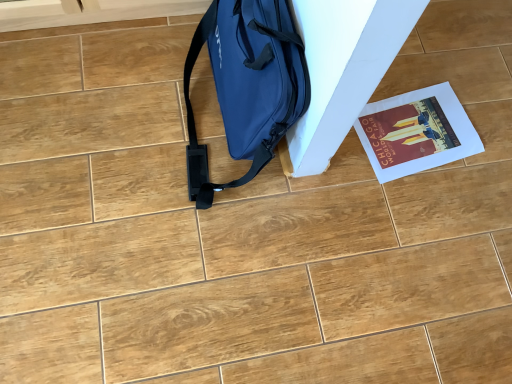
At what (x,y) coordinates should I click in order to perform the action: click on vacant space underneath matte paper poster at lower right (from a real-world perspective). Please return your answer as a coordinate pair (x, y). Image resolution: width=512 pixels, height=384 pixels. Looking at the image, I should click on (418, 139).